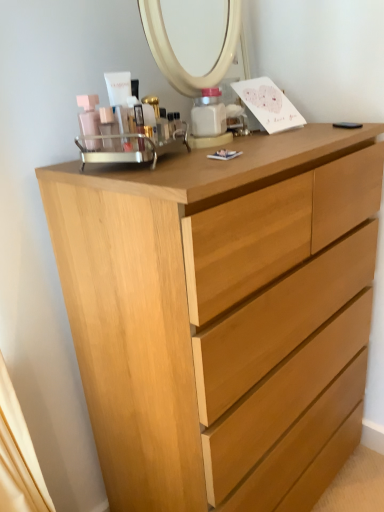
Question: From the image's perspective, is matte plastic container at center under light wood chest of drawers at center?

Choices:
 (A) no
 (B) yes

Answer: (A)

Question: Is matte plastic container at center smaller than light wood chest of drawers at center?

Choices:
 (A) yes
 (B) no

Answer: (A)

Question: From the image's perspective, would you say matte plastic container at center is positioned over light wood chest of drawers at center?

Choices:
 (A) no
 (B) yes

Answer: (B)

Question: Is matte plastic container at center next to light wood chest of drawers at center?

Choices:
 (A) yes
 (B) no

Answer: (B)

Question: Considering the relative positions of matte plastic container at center and light wood chest of drawers at center in the image provided, is matte plastic container at center to the right of light wood chest of drawers at center from the viewer's perspective?

Choices:
 (A) no
 (B) yes

Answer: (A)

Question: Are matte plastic container at center and light wood chest of drawers at center far apart?

Choices:
 (A) no
 (B) yes

Answer: (A)

Question: Could you tell me if light wood chest of drawers at center is turned towards matte plastic container at center?

Choices:
 (A) yes
 (B) no

Answer: (B)

Question: Is light wood chest of drawers at center facing away from matte plastic container at center?

Choices:
 (A) yes
 (B) no

Answer: (B)

Question: Is light wood chest of drawers at center in contact with matte plastic container at center?

Choices:
 (A) yes
 (B) no

Answer: (B)

Question: From the image's perspective, is light wood chest of drawers at center beneath matte plastic container at center?

Choices:
 (A) no
 (B) yes

Answer: (B)

Question: Could matte plastic container at center be considered to be inside light wood chest of drawers at center?

Choices:
 (A) yes
 (B) no

Answer: (B)

Question: Is light wood chest of drawers at center to the left of matte plastic container at center from the viewer's perspective?

Choices:
 (A) yes
 (B) no

Answer: (B)

Question: In terms of width, does matte plastic container at center look wider or thinner when compared to light wood chest of drawers at center?

Choices:
 (A) wide
 (B) thin

Answer: (B)